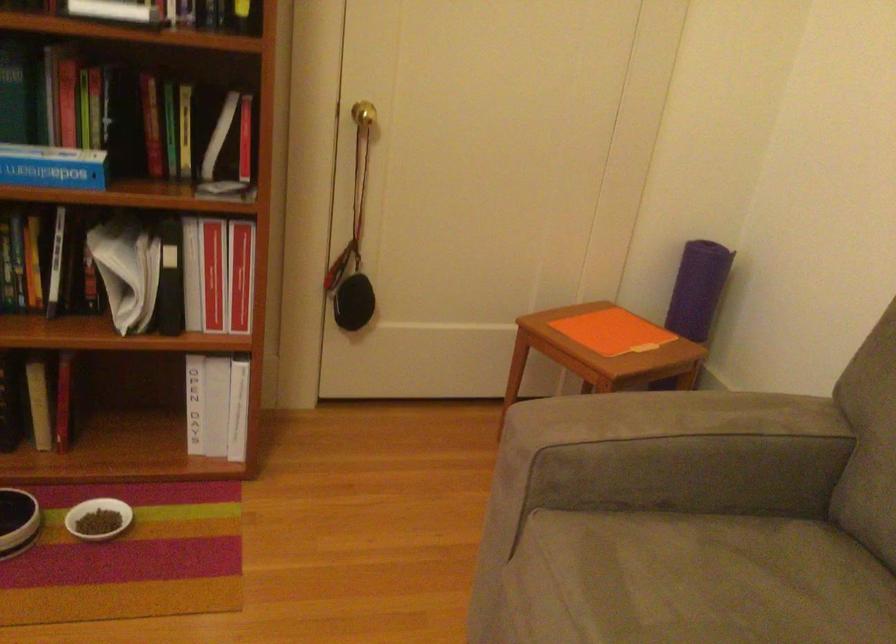
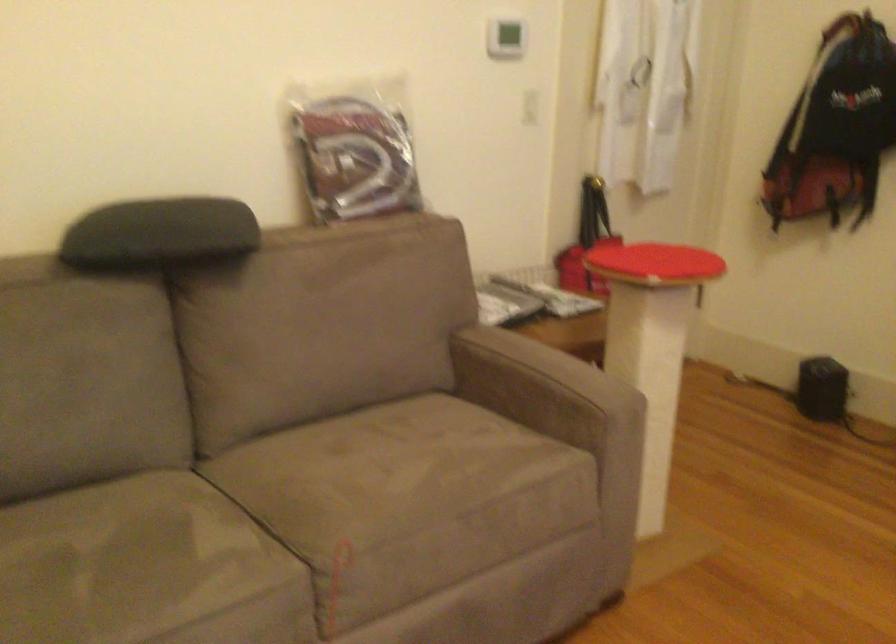
How did the camera likely rotate?

The camera rotated toward right-down.